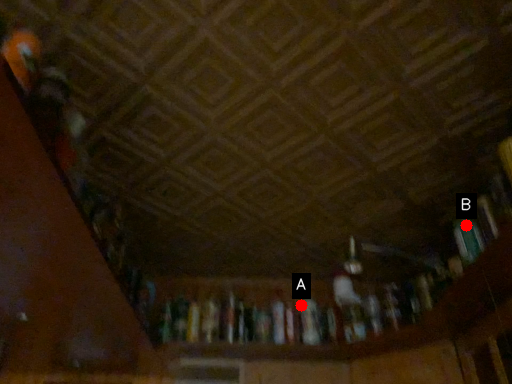
Question: Two points are circled on the image, labeled by A and B beside each circle. Which point is closer to the camera?

Choices:
 (A) A is closer
 (B) B is closer

Answer: (B)